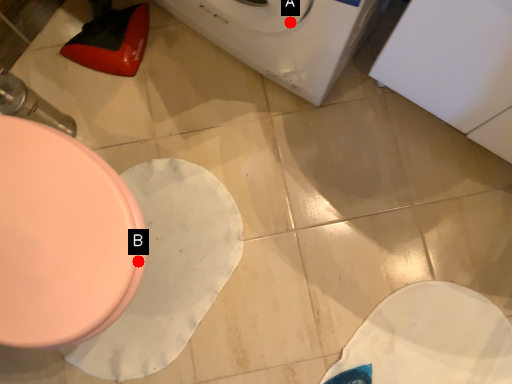
Question: Two points are circled on the image, labeled by A and B beside each circle. Which point appears closest to the camera in this image?

Choices:
 (A) A is closer
 (B) B is closer

Answer: (B)